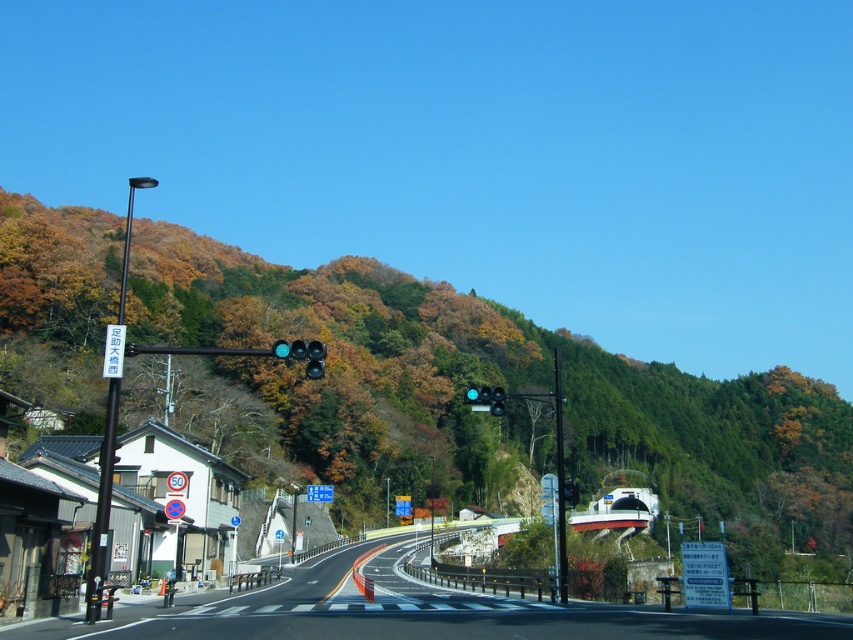
You are a driver approaching the intersection and need to know the position of the green leafy hillside at upper center relative to the matte black traffic light at upper center. Which side of the traffic light is the hillside located on?

The green leafy hillside at upper center is to the right of the matte black traffic light at upper center, so the hillside is on the right side of the traffic light.

Based on the photo, you are standing at the intersection and want to know how far the point at coordinates point (306, 328) is from your current position. Can you determine the distance?

The distance between point (306, 328) and the viewer is 494.11 feet.

You are a drone operator planning to fly a drone between the green leafy hillside at upper center and the matte black traffic light at center. The drone has a maximum flight range of 90 meters. Based on the scene, can the drone safely make the trip without running out of battery?

The green leafy hillside at upper center and matte black traffic light at center are 91.34 meters apart from each other. Since the drone can only fly up to 90 meters, it cannot safely make the trip without running out of battery.